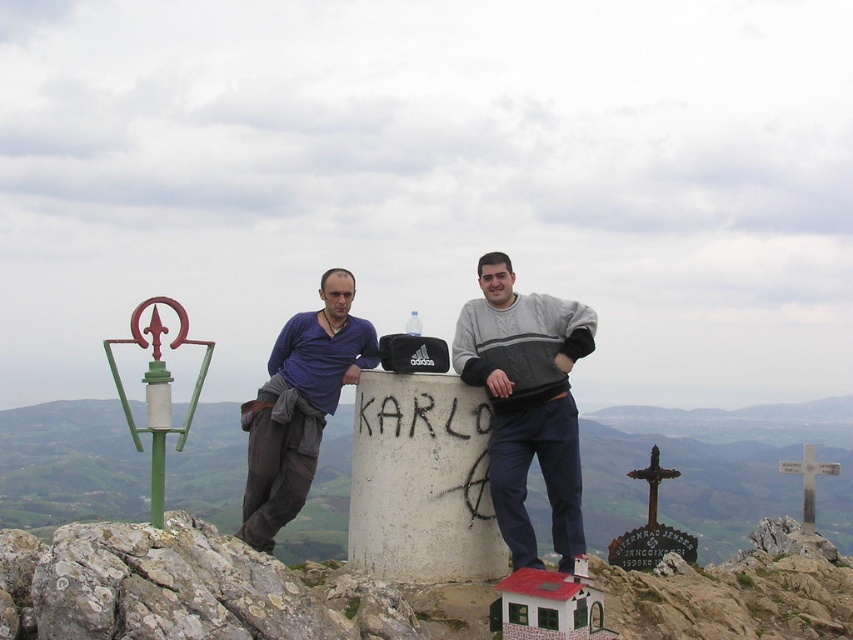
Does point (109, 577) lie behind point (283, 356)?

No, it is not.

Is point (303, 592) positioned behind point (299, 412)?

No, it is in front of (299, 412).

You are a GUI agent. You are given a task and a screenshot of the screen. Output one action in this format:
    pyautogui.click(x=<x>, y=<y>)
    Task: Click on the white concrete cylinder at center
    The width and height of the screenshot is (853, 640).
    Given the screenshot: What is the action you would take?
    pyautogui.click(x=207, y=589)

Which is below, white concrete cylinder at center or gray sweater at center?

white concrete cylinder at center is below.

The image size is (853, 640). Identify the location of white concrete cylinder at center. (207, 589).

Identify the location of white concrete cylinder at center. (207, 589).

This screenshot has height=640, width=853. Describe the element at coordinates (526, 403) in the screenshot. I see `gray sweater at center` at that location.

Is gray sweater at center positioned at the back of blue cotton shirt at center?

No, it is in front of blue cotton shirt at center.

Describe the element at coordinates (526, 403) in the screenshot. The width and height of the screenshot is (853, 640). I see `gray sweater at center` at that location.

Where is `gray sweater at center`? The height and width of the screenshot is (640, 853). gray sweater at center is located at coordinates (526, 403).